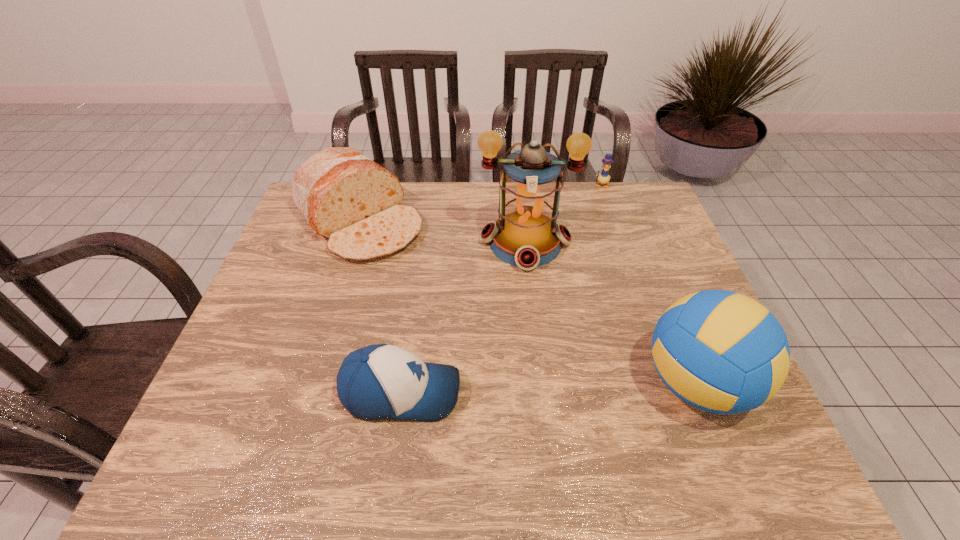
The width and height of the screenshot is (960, 540). I want to click on baseball cap that is at the near edge, so point(382,381).

Where is `volleyball at the near edge`? The width and height of the screenshot is (960, 540). volleyball at the near edge is located at coordinates (722, 352).

Find the location of `object that is at the left edge`. object that is at the left edge is located at coordinates (346, 197).

Where is `volleyball that is at the right edge`? The image size is (960, 540). volleyball that is at the right edge is located at coordinates (722, 352).

In order to click on duckling present at the right edge in this screenshot , I will do `click(603, 178)`.

The height and width of the screenshot is (540, 960). I want to click on object located at the far left corner, so click(x=346, y=197).

Locate an element on the screen. Image resolution: width=960 pixels, height=540 pixels. object at the far right corner is located at coordinates click(603, 178).

Where is `object that is positioned at the near right corner`? This screenshot has height=540, width=960. object that is positioned at the near right corner is located at coordinates (722, 352).

Where is `vacant region at the far edge`? vacant region at the far edge is located at coordinates (438, 207).

This screenshot has width=960, height=540. I want to click on vacant space at the near edge of the desktop, so click(619, 389).